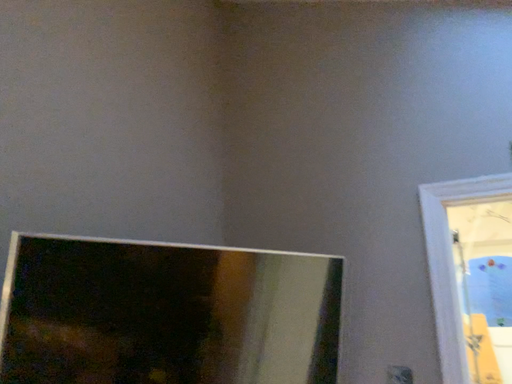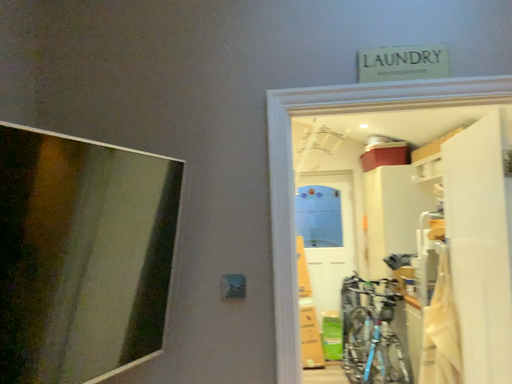
Question: Which way did the camera rotate in the video?

Choices:
 (A) rotated upward
 (B) rotated downward

Answer: (B)